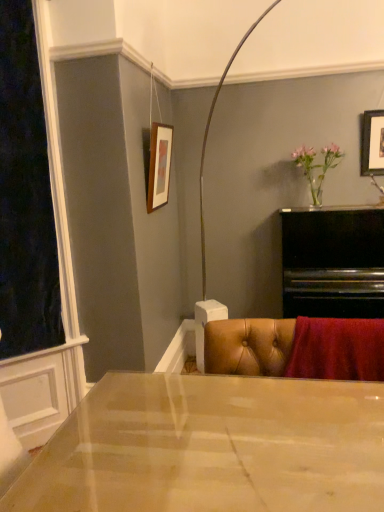
Question: Can you confirm if wooden picture frame at upper right, which ranks as the second picture frame in left-to-right order, is thinner than pink glass vase at upper right?

Choices:
 (A) yes
 (B) no

Answer: (A)

Question: Is wooden picture frame at upper right, which ranks as the second picture frame in left-to-right order, positioned in front of pink glass vase at upper right?

Choices:
 (A) yes
 (B) no

Answer: (B)

Question: Is wooden picture frame at upper right, which ranks as the second picture frame in left-to-right order, to the left of pink glass vase at upper right from the viewer's perspective?

Choices:
 (A) yes
 (B) no

Answer: (B)

Question: Can you confirm if wooden picture frame at upper right, positioned as the 1th picture frame in right-to-left order, is positioned to the right of pink glass vase at upper right?

Choices:
 (A) yes
 (B) no

Answer: (A)

Question: Considering the relative positions of wooden picture frame at upper right, which ranks as the second picture frame in left-to-right order, and pink glass vase at upper right in the image provided, is wooden picture frame at upper right, which ranks as the second picture frame in left-to-right order, behind pink glass vase at upper right?

Choices:
 (A) yes
 (B) no

Answer: (A)

Question: Is wooden picture frame at upper right, positioned as the 1th picture frame in right-to-left order, facing towards pink glass vase at upper right?

Choices:
 (A) yes
 (B) no

Answer: (B)

Question: Is the position of wooden picture frame at upper right, which ranks as the second picture frame in left-to-right order, less distant than that of matte wooden picture frame at upper center, the second picture frame in the right-to-left sequence?

Choices:
 (A) no
 (B) yes

Answer: (A)

Question: Could matte wooden picture frame at upper center, the first picture frame from the left, be considered to be inside wooden picture frame at upper right, positioned as the 1th picture frame in right-to-left order?

Choices:
 (A) yes
 (B) no

Answer: (B)

Question: Is wooden picture frame at upper right, which ranks as the second picture frame in left-to-right order, completely or partially outside of matte wooden picture frame at upper center, the second picture frame in the right-to-left sequence?

Choices:
 (A) yes
 (B) no

Answer: (A)

Question: Does wooden picture frame at upper right, which ranks as the second picture frame in left-to-right order, have a lesser height compared to matte wooden picture frame at upper center, the first picture frame from the left?

Choices:
 (A) no
 (B) yes

Answer: (B)

Question: Does wooden picture frame at upper right, which ranks as the second picture frame in left-to-right order, appear on the right side of matte wooden picture frame at upper center, the second picture frame in the right-to-left sequence?

Choices:
 (A) yes
 (B) no

Answer: (A)

Question: From a real-world perspective, is wooden picture frame at upper right, which ranks as the second picture frame in left-to-right order, physically below matte wooden picture frame at upper center, the first picture frame from the left?

Choices:
 (A) no
 (B) yes

Answer: (A)

Question: Does matte wooden picture frame at upper center, the second picture frame in the right-to-left sequence, appear on the right side of wooden picture frame at upper right, which ranks as the second picture frame in left-to-right order?

Choices:
 (A) no
 (B) yes

Answer: (A)